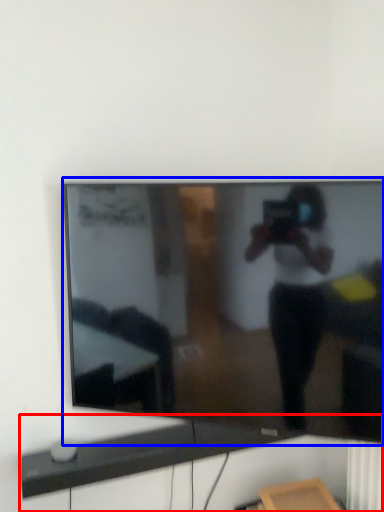
Question: Which object is closer to the camera taking this photo, computer desk (highlighted by a red box) or television (highlighted by a blue box)?

Choices:
 (A) computer desk
 (B) television

Answer: (B)